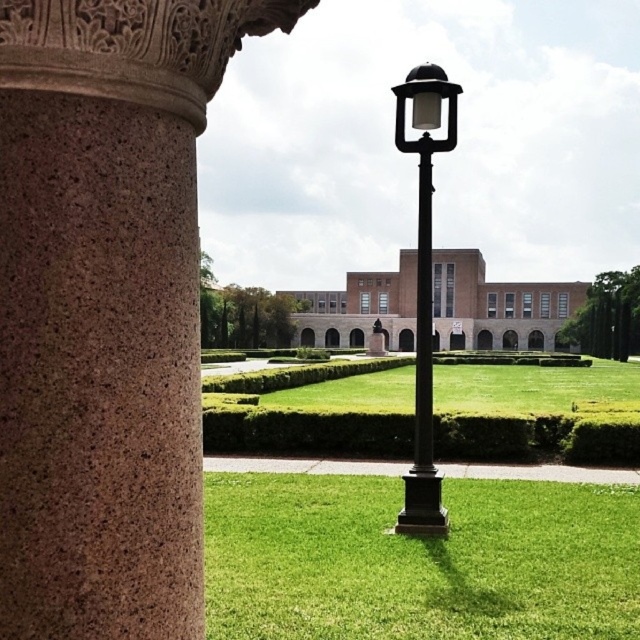
You are standing at the point marked as point (419, 561) in the image. What is the terrain type under your feet?

The terrain type under your feet at point (419, 561) is green grass at center.

From the picture: You are standing at the center of the image and want to walk towards the brown speckled stone column at left. In which direction should you move?

The brown speckled stone column at left is located at coordinates approximately 0.483 on the x and 0.164 on the y axis. Since you are at the center, you should move to the left and slightly downward to reach it.